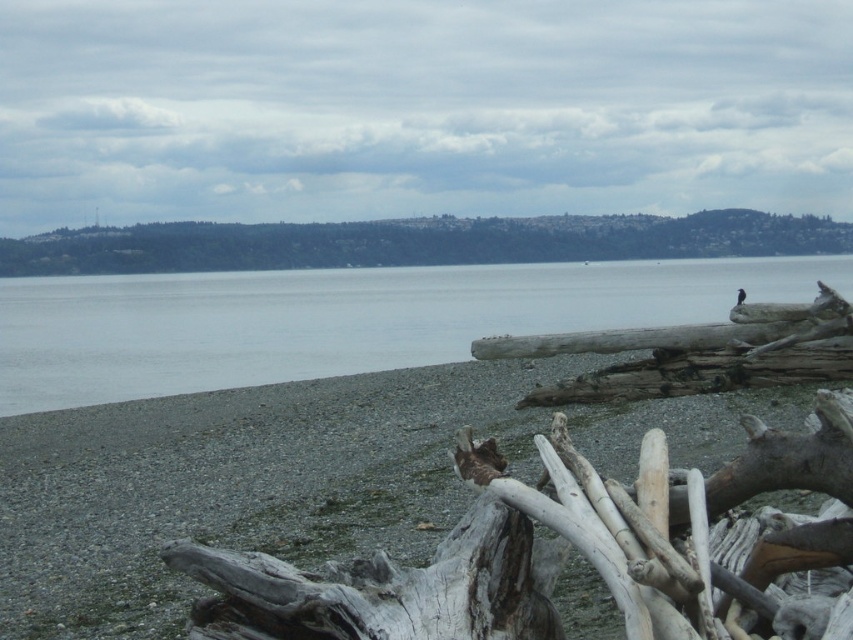
Question: Which point appears farthest from the camera in this image?

Choices:
 (A) (547, 400)
 (B) (196, 352)

Answer: (B)

Question: Does gray water at center appear on the left side of gray weathered log at right?

Choices:
 (A) no
 (B) yes

Answer: (B)

Question: Is gray water at center bigger than gray weathered log at right?

Choices:
 (A) yes
 (B) no

Answer: (A)

Question: Which point is closer to the camera?

Choices:
 (A) gray water at center
 (B) gray weathered log at right

Answer: (B)

Question: Observing the image, what is the correct spatial positioning of gray water at center in reference to gray weathered log at right?

Choices:
 (A) below
 (B) above

Answer: (B)